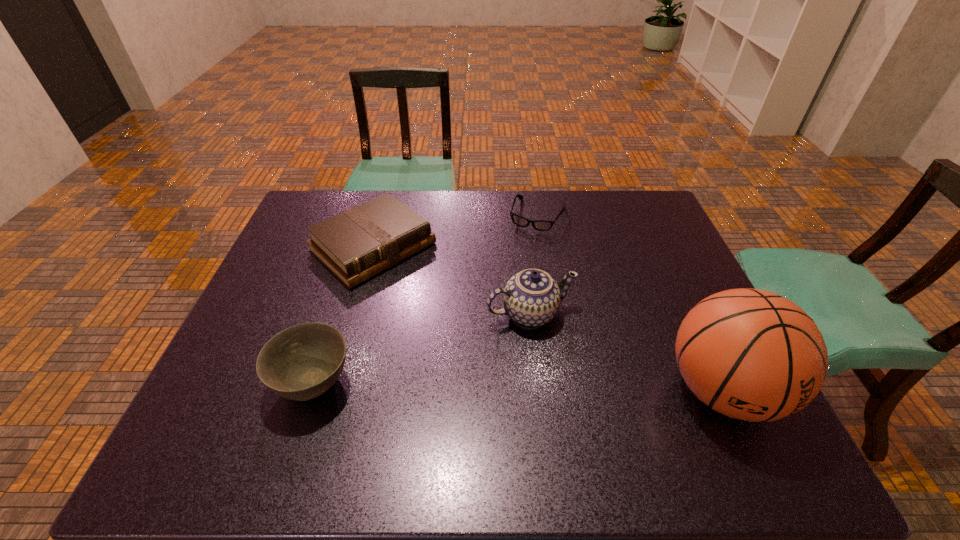
Find the location of a particular element. This screenshot has height=540, width=960. vacant spot on the desktop that is between the bowl and the rightmost object and is positioned on the front-facing side of the spectacles is located at coordinates (461, 386).

This screenshot has width=960, height=540. I want to click on vacant space on the desktop that is between the bowl and the rightmost object and is positioned on the spine side of the second shortest object, so click(x=543, y=387).

Find the location of a particular element. This screenshot has width=960, height=540. vacant space on the desktop that is between the bowl and the rightmost object and is positioned at the spout of the third farthest object is located at coordinates (567, 387).